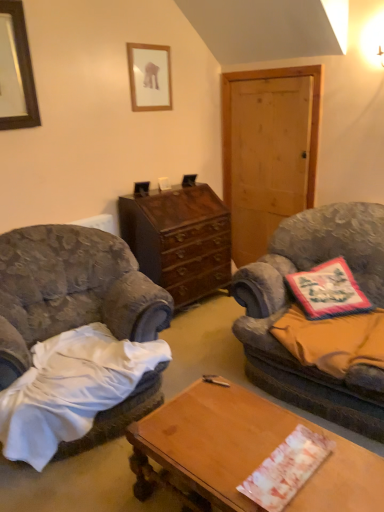
The width and height of the screenshot is (384, 512). What are the coordinates of `free location to the right of white paper at center, the 2th sheet from the top` in the screenshot? It's located at (345, 473).